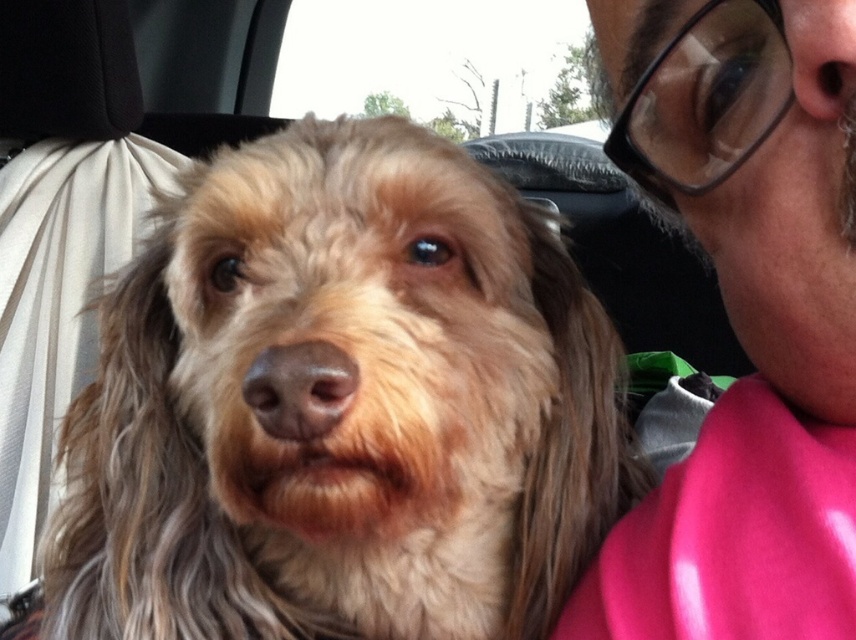
Is fuzzy brown dog at center to the right of matte black glasses at upper left from the viewer's perspective?

Incorrect, fuzzy brown dog at center is not on the right side of matte black glasses at upper left.

Does point (351, 490) lie behind point (813, 220)?

No, it is in front of (813, 220).

At what (x,y) coordinates should I click in order to perform the action: click on fuzzy brown dog at center. Please return your answer as a coordinate pair (x, y). The width and height of the screenshot is (856, 640). Looking at the image, I should click on (340, 406).

Is point (803, 547) farther from viewer compared to point (409, 19)?

No, it is not.

Which of these two, matte black glasses at upper left or transparent glass car window at upper center, stands taller?

Standing taller between the two is transparent glass car window at upper center.

This screenshot has height=640, width=856. Find the location of `matte black glasses at upper left`. matte black glasses at upper left is located at coordinates (744, 317).

Which is above, fuzzy brown dog at center or transparent glass car window at upper center?

transparent glass car window at upper center is higher up.

Does fuzzy brown dog at center have a greater width compared to transparent glass car window at upper center?

No, fuzzy brown dog at center is not wider than transparent glass car window at upper center.

The width and height of the screenshot is (856, 640). I want to click on fuzzy brown dog at center, so click(x=340, y=406).